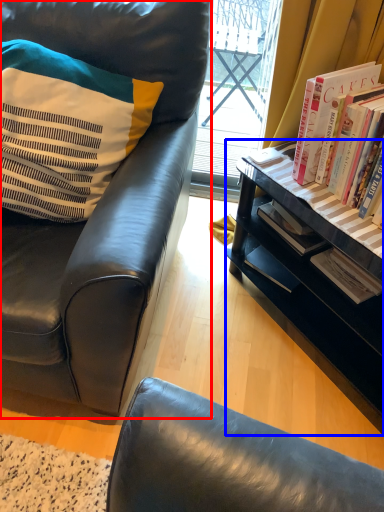
Question: Which object appears closest to the camera in this image, chair (highlighted by a red box) or desk (highlighted by a blue box)?

Choices:
 (A) chair
 (B) desk

Answer: (A)